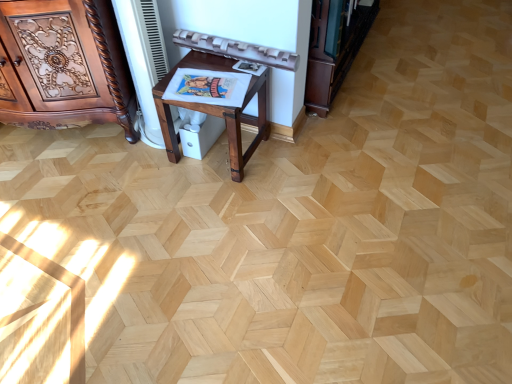
The height and width of the screenshot is (384, 512). Identify the location of free spot in front of mahogany wood table at center. (218, 201).